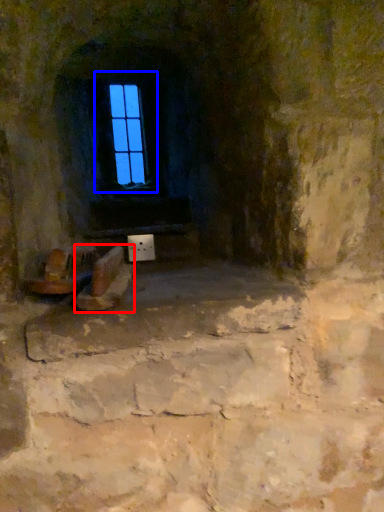
Question: Among these objects, which one is farthest to the camera, footwear (highlighted by a red box) or window (highlighted by a blue box)?

Choices:
 (A) footwear
 (B) window

Answer: (B)